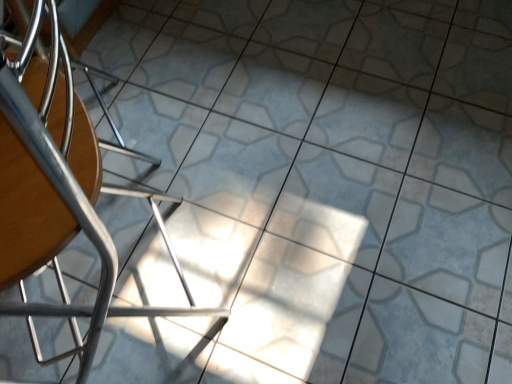
Locate an element on the screen. matte wood chair at left is located at coordinates (68, 195).

What do you see at coordinates (68, 195) in the screenshot? I see `matte wood chair at left` at bounding box center [68, 195].

Image resolution: width=512 pixels, height=384 pixels. In order to click on matte wood chair at left in this screenshot , I will do `click(68, 195)`.